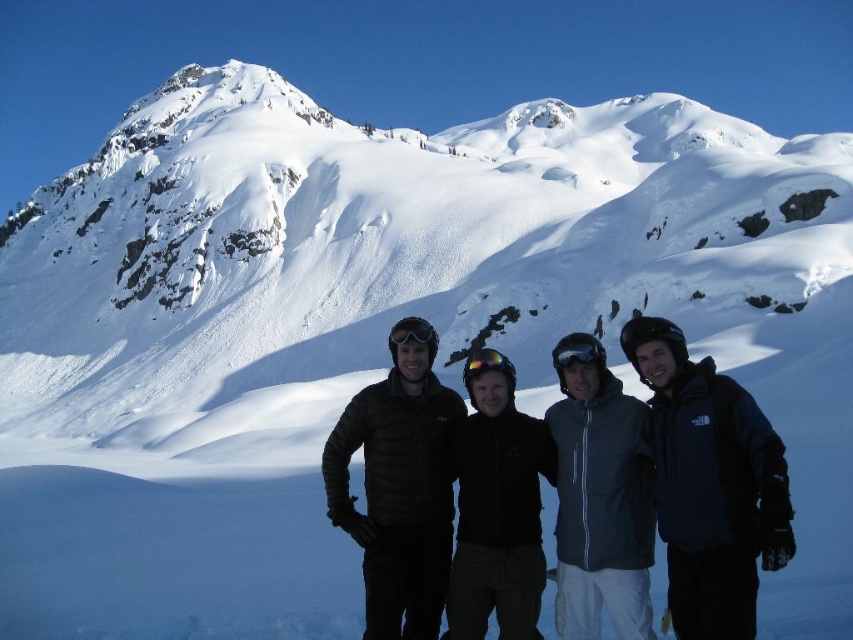
Question: Which point is closer to the camera?

Choices:
 (A) (399, 337)
 (B) (502, 554)

Answer: (B)

Question: Can you confirm if gray fleece jacket at center is positioned above glossy plastic goggles at center?

Choices:
 (A) yes
 (B) no

Answer: (B)

Question: Which object is closer to the camera taking this photo?

Choices:
 (A) black matte goggles at center
 (B) gray fleece jacket at center

Answer: (B)

Question: Which of the following is the closest to the observer?

Choices:
 (A) (491, 417)
 (B) (434, 484)
 (C) (625, 451)

Answer: (C)

Question: Is black puffer jacket at center below black matte goggles at center?

Choices:
 (A) no
 (B) yes

Answer: (B)

Question: Is black softshell jacket at center behind black matte goggles at center?

Choices:
 (A) no
 (B) yes

Answer: (A)